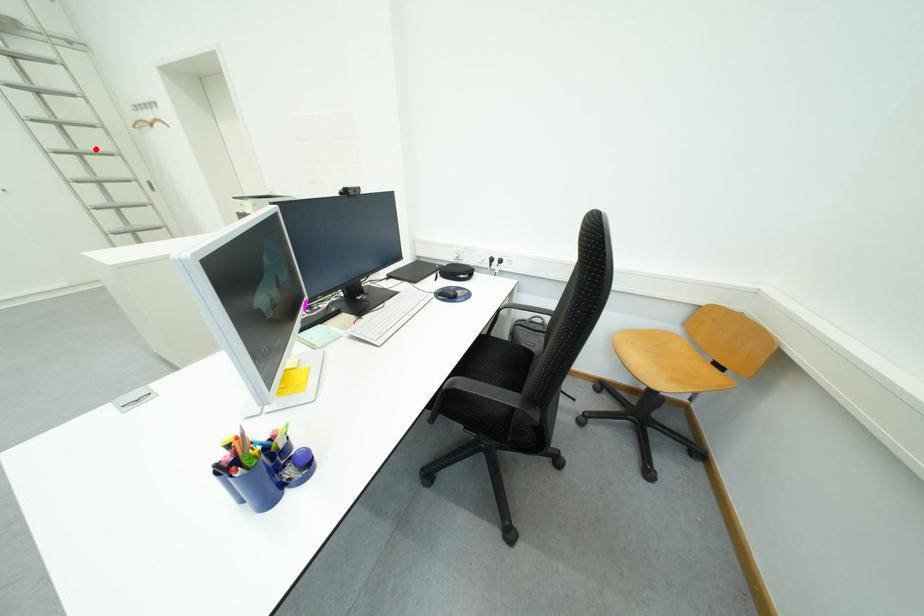
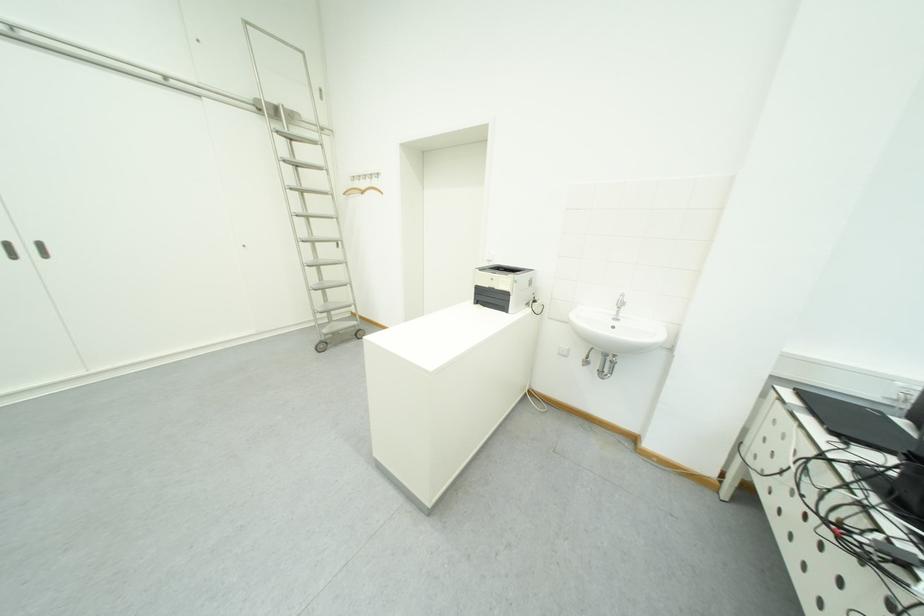
Question: I am providing you with two images of the same scene from different viewpoints. A red point is marked on the first image. Can you still see the location of the red point in image 2?

Choices:
 (A) Yes
 (B) No

Answer: (A)